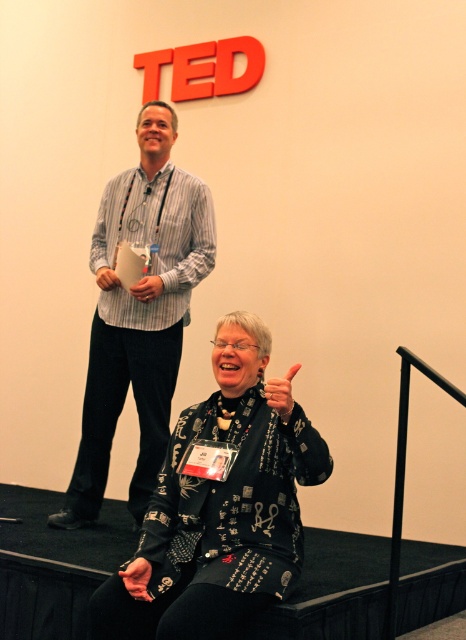
Question: Among these objects, which one is farthest from the camera?

Choices:
 (A) striped cotton shirt at upper left
 (B) printed fabric sweater at lower center

Answer: (A)

Question: Is printed fabric sweater at lower center wider than striped cotton shirt at upper left?

Choices:
 (A) no
 (B) yes

Answer: (A)

Question: Which of the following is the closest to the observer?

Choices:
 (A) (109, 381)
 (B) (186, 497)

Answer: (B)

Question: From the image, what is the correct spatial relationship of printed fabric sweater at lower center in relation to striped cotton shirt at upper left?

Choices:
 (A) right
 (B) left

Answer: (A)

Question: Can you confirm if printed fabric sweater at lower center is thinner than striped cotton shirt at upper left?

Choices:
 (A) no
 (B) yes

Answer: (B)